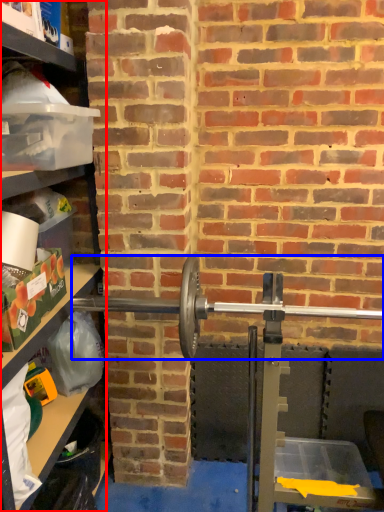
Question: Which point is further to the camera, shelf (highlighted by a red box) or barbell (highlighted by a blue box)?

Choices:
 (A) shelf
 (B) barbell

Answer: (B)